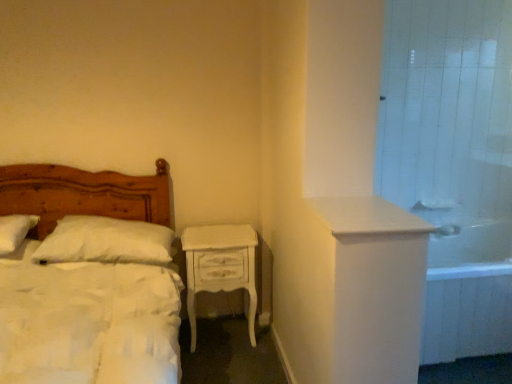
Question: Is the depth of white painted wood nightstand at center greater than that of white glossy sink at upper right?

Choices:
 (A) no
 (B) yes

Answer: (A)

Question: From a real-world perspective, is white painted wood nightstand at center positioned over white glossy sink at upper right based on gravity?

Choices:
 (A) yes
 (B) no

Answer: (B)

Question: Considering the relative sizes of white painted wood nightstand at center and white glossy sink at upper right in the image provided, is white painted wood nightstand at center thinner than white glossy sink at upper right?

Choices:
 (A) no
 (B) yes

Answer: (A)

Question: Is white painted wood nightstand at center not close to white glossy sink at upper right?

Choices:
 (A) no
 (B) yes

Answer: (B)

Question: Is white painted wood nightstand at center completely or partially outside of white glossy sink at upper right?

Choices:
 (A) no
 (B) yes

Answer: (B)

Question: In terms of width, does white glossy bathtub at right look wider or thinner when compared to white soft pillow at left, the second pillow viewed from the left?

Choices:
 (A) wide
 (B) thin

Answer: (A)

Question: Relative to white soft pillow at left, the 1th pillow when ordered from right to left, is white glossy bathtub at right in front or behind?

Choices:
 (A) front
 (B) behind

Answer: (A)

Question: From a real-world perspective, is white glossy bathtub at right above or below white soft pillow at left, the 1th pillow when ordered from right to left?

Choices:
 (A) below
 (B) above

Answer: (A)

Question: In terms of height, does white glossy bathtub at right look taller or shorter compared to white soft pillow at left, the second pillow viewed from the left?

Choices:
 (A) short
 (B) tall

Answer: (B)

Question: In terms of height, does white soft pillow at left, the second pillow viewed from the left, look taller or shorter compared to white glossy bathtub at right?

Choices:
 (A) short
 (B) tall

Answer: (A)

Question: From the image's perspective, is white soft pillow at left, the second pillow viewed from the left, above or below white glossy bathtub at right?

Choices:
 (A) below
 (B) above

Answer: (B)

Question: From a real-world perspective, relative to white glossy bathtub at right, is white soft pillow at left, the 1th pillow when ordered from right to left, vertically above or below?

Choices:
 (A) above
 (B) below

Answer: (A)

Question: Considering the relative positions of white soft pillow at left, the 1th pillow when ordered from right to left, and white glossy bathtub at right in the image provided, is white soft pillow at left, the 1th pillow when ordered from right to left, to the left or to the right of white glossy bathtub at right?

Choices:
 (A) right
 (B) left

Answer: (B)

Question: Considering the positions of white glossy sink at upper right and white tile shower door at upper right in the image, is white glossy sink at upper right wider or thinner than white tile shower door at upper right?

Choices:
 (A) thin
 (B) wide

Answer: (A)

Question: Considering the positions of white glossy sink at upper right and white tile shower door at upper right in the image, is white glossy sink at upper right taller or shorter than white tile shower door at upper right?

Choices:
 (A) tall
 (B) short

Answer: (B)